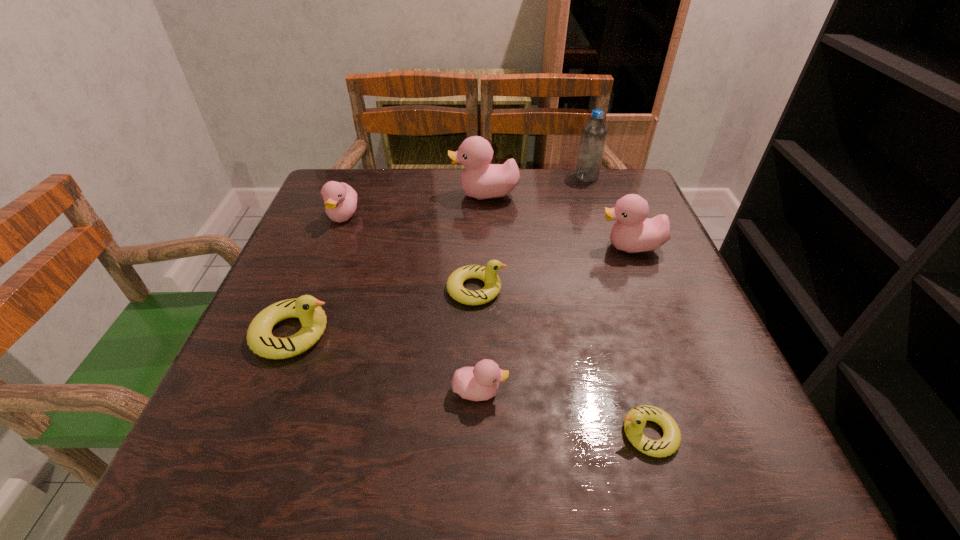
Locate an element on the screen. the second yellow duckling from right to left is located at coordinates (488, 274).

Where is `the nearest duckling`? the nearest duckling is located at coordinates coord(635,420).

Find the location of a particular element. the rightmost yellow duckling is located at coordinates (635, 420).

At what (x,y) coordinates should I click in order to perform the action: click on vacant area situated on the front of the tallest object. Please return your answer as a coordinate pair (x, y). This screenshot has width=960, height=540. Looking at the image, I should click on (607, 235).

The image size is (960, 540). I want to click on free region located 0.220m on the front-facing side of the biggest pink duckling, so click(x=366, y=194).

Where is `vacant space located on the front-facing side of the biggest pink duckling`? The height and width of the screenshot is (540, 960). vacant space located on the front-facing side of the biggest pink duckling is located at coordinates (354, 194).

Find the location of `vacant space located on the front-facing side of the biggest pink duckling`. vacant space located on the front-facing side of the biggest pink duckling is located at coordinates (431, 194).

Locate an element on the screen. free space located on the front-facing side of the sixth shortest duckling is located at coordinates (468, 247).

Locate an element on the screen. The height and width of the screenshot is (540, 960). vacant area situated 0.090m on the front-facing side of the sixth shortest duckling is located at coordinates (557, 247).

The height and width of the screenshot is (540, 960). Identify the location of free space located 0.070m on the front-facing side of the sixth shortest duckling. (566, 247).